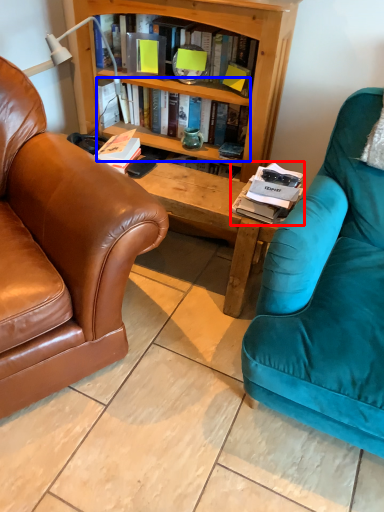
Question: Which object appears farthest to the camera in this image, magazine (highlighted by a red box) or book (highlighted by a blue box)?

Choices:
 (A) magazine
 (B) book

Answer: (B)